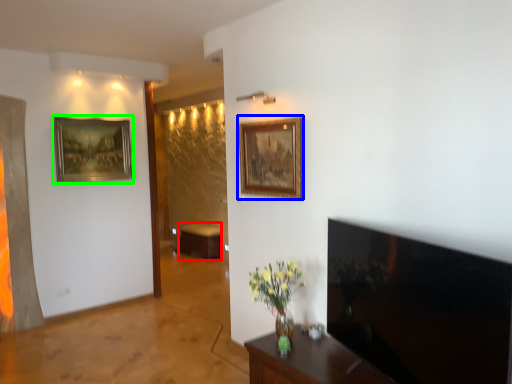
Question: Considering the real-world distances, which object is farthest from table (highlighted by a red box)? picture frame (highlighted by a blue box) or picture frame (highlighted by a green box)?

Choices:
 (A) picture frame
 (B) picture frame

Answer: (A)